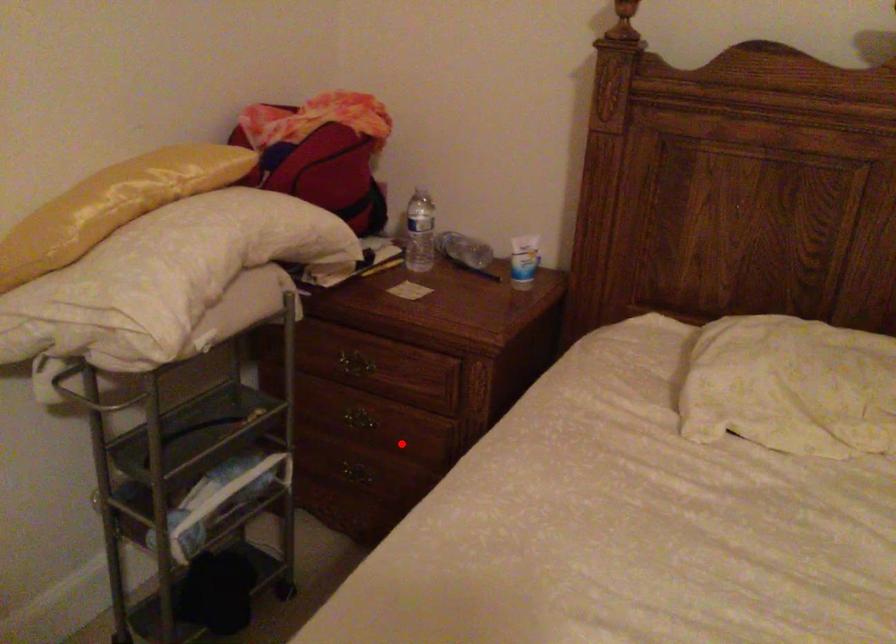
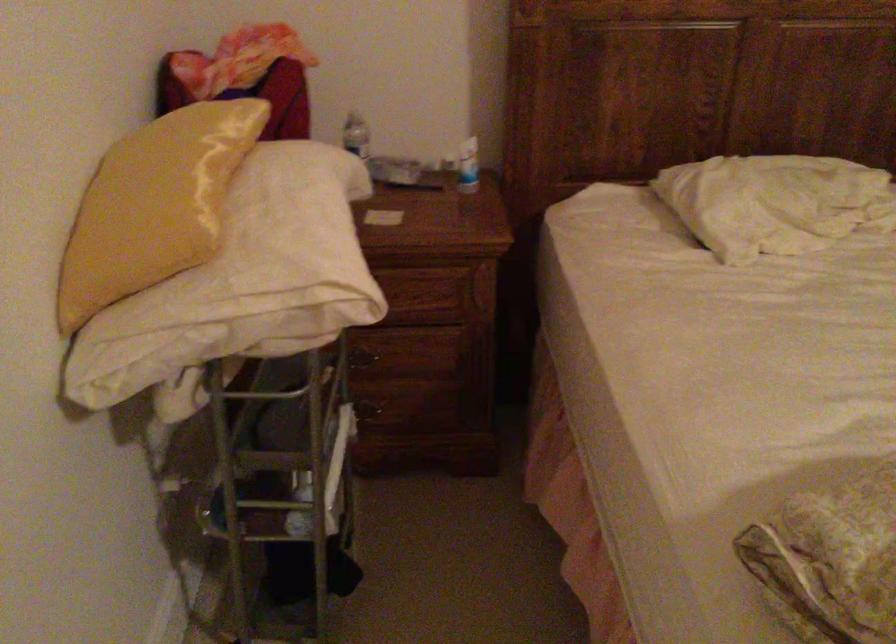
In the second image, find the point that corresponds to the highlighted location in the first image.

(412, 365)